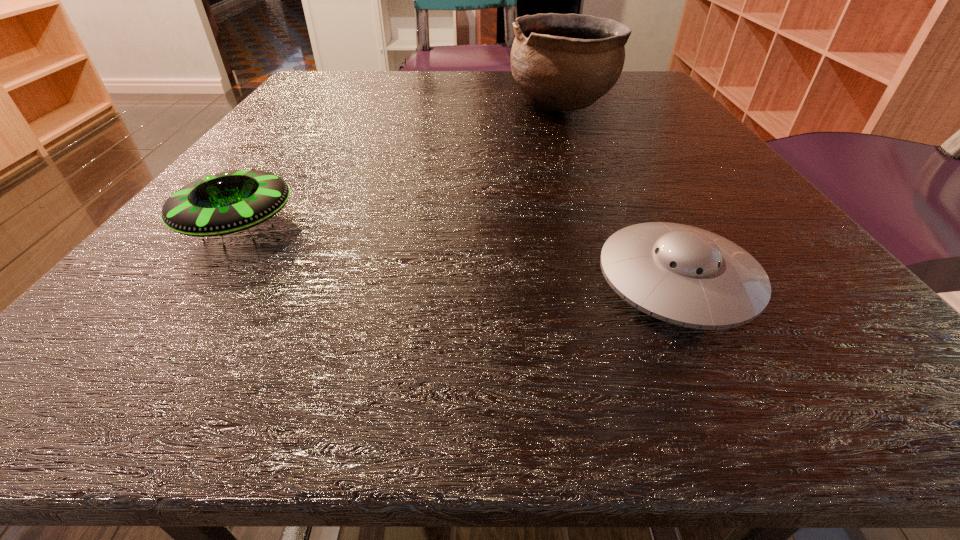
In the image, there is a desktop. In order to click on vacant space at the near left corner in this screenshot , I will do `click(143, 333)`.

In order to click on free space between the shortest object and the left saucer in this screenshot , I will do `click(458, 253)`.

The height and width of the screenshot is (540, 960). Identify the location of vacant area between the taller saucer and the farthest object. coord(400,165).

At what (x,y) coordinates should I click in order to perform the action: click on vacant space that's between the leftmost object and the pottery. Please return your answer as a coordinate pair (x, y). The image size is (960, 540). Looking at the image, I should click on (400, 165).

Find the location of a particular element. The width and height of the screenshot is (960, 540). empty space between the shorter saucer and the tallest object is located at coordinates (619, 193).

Where is `free space that is in between the tallest object and the shortest object`? free space that is in between the tallest object and the shortest object is located at coordinates (619, 193).

Locate an element on the screen. free space between the shorter saucer and the farthest object is located at coordinates (619, 193).

Image resolution: width=960 pixels, height=540 pixels. I want to click on empty location between the second shortest object and the shortest object, so click(458, 253).

Find the location of a particular element. free space between the leftmost object and the shorter saucer is located at coordinates [x=458, y=253].

You are a GUI agent. You are given a task and a screenshot of the screen. Output one action in this format:
    pyautogui.click(x=<x>, y=<y>)
    Task: Click on the vacant point located between the shorter saucer and the second tallest object
    The height and width of the screenshot is (540, 960).
    Given the screenshot: What is the action you would take?
    pyautogui.click(x=458, y=253)